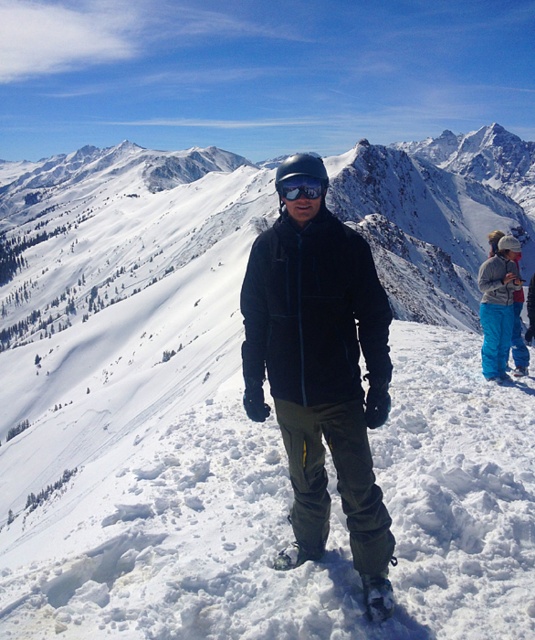
Is matte black jacket at center below matte blue snow pants at right?

Actually, matte black jacket at center is above matte blue snow pants at right.

Is matte black jacket at center behind matte blue snow pants at right?

No, matte black jacket at center is in front of matte blue snow pants at right.

Find the location of a particular element. This screenshot has height=640, width=535. matte black jacket at center is located at coordinates (322, 380).

In the scene shown: Between matte blue snow pants at right and black matte goggles at center, which one appears on the right side from the viewer's perspective?

From the viewer's perspective, matte blue snow pants at right appears more on the right side.

Who is more distant from viewer, (506, 364) or (314, 195)?

Positioned behind is point (506, 364).

Where is `matte blue snow pants at right`? matte blue snow pants at right is located at coordinates 498,301.

Is matte black jacket at center shorter than black matte goggles at center?

In fact, matte black jacket at center may be taller than black matte goggles at center.

Is matte black jacket at center thinner than black matte goggles at center?

No, matte black jacket at center is not thinner than black matte goggles at center.

Which is in front, point (257, 364) or point (276, 188)?

Positioned in front is point (257, 364).

Image resolution: width=535 pixels, height=640 pixels. What are the coordinates of `matte black jacket at center` in the screenshot? It's located at (322, 380).